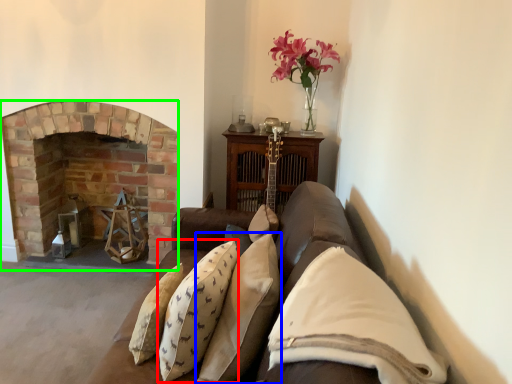
Question: Which object is the farthest from pillow (highlighted by a red box)? Choose among these: pillow (highlighted by a blue box) or fireplace (highlighted by a green box).

Choices:
 (A) pillow
 (B) fireplace

Answer: (B)